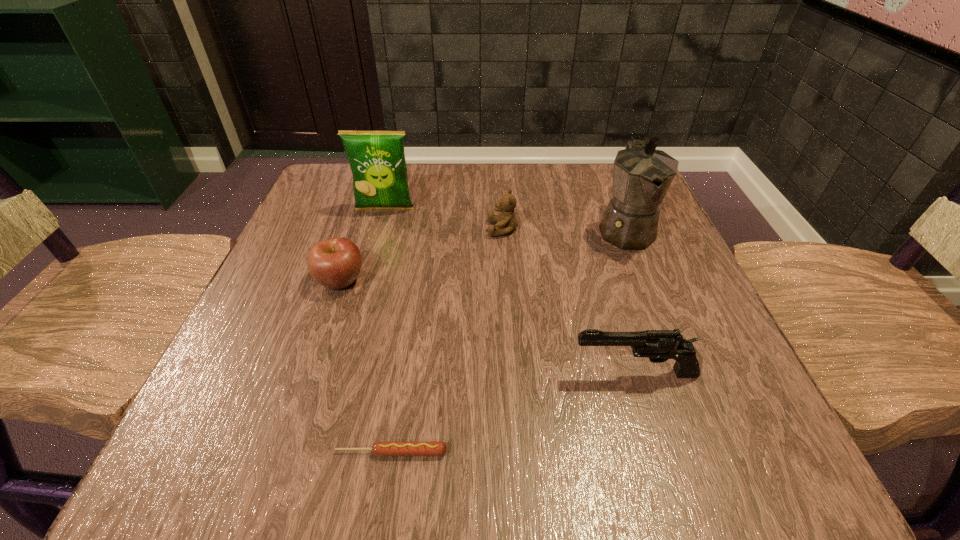
Image resolution: width=960 pixels, height=540 pixels. Find the location of `free spot located at the end of the barrel of the fifth farthest object`. free spot located at the end of the barrel of the fifth farthest object is located at coordinates (503, 374).

The height and width of the screenshot is (540, 960). What are the coordinates of `vacant space located at the end of the barrel of the fifth farthest object` in the screenshot? It's located at (436, 374).

Find the location of a particular element. The width and height of the screenshot is (960, 540). free space located on the front-facing side of the teddy bear is located at coordinates (366, 229).

Locate an element on the screen. free space located on the front-facing side of the teddy bear is located at coordinates (424, 229).

The image size is (960, 540). What are the coordinates of `vacant region located 0.200m on the front-facing side of the teddy bear` in the screenshot? It's located at point(391,229).

Where is `free space located 0.300m on the side of the apple with the unique marking`? This screenshot has height=540, width=960. free space located 0.300m on the side of the apple with the unique marking is located at coordinates (532, 280).

The image size is (960, 540). In order to click on vacant space located on the back of the sausage in this screenshot , I will do 413,313.

This screenshot has width=960, height=540. In order to click on coffeepot located at the far edge in this screenshot , I will do `click(642, 175)`.

Identify the location of crisp (potato chip) at the far edge. The height and width of the screenshot is (540, 960). (377, 160).

Where is `teddy bear present at the far edge`? The height and width of the screenshot is (540, 960). teddy bear present at the far edge is located at coordinates (506, 222).